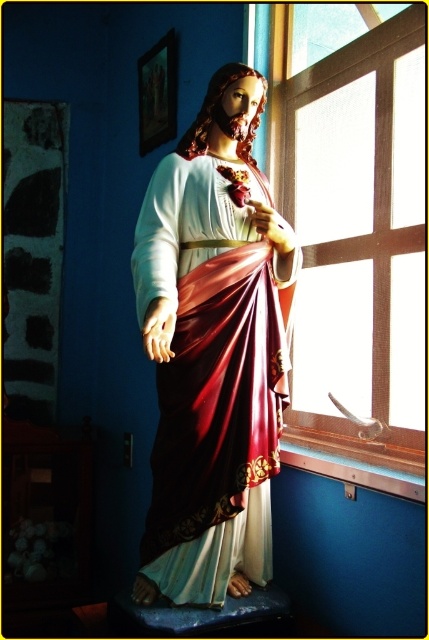
Question: Among these objects, which one is nearest to the camera?

Choices:
 (A) clear glass window at center
 (B) matte gold statue at center

Answer: (B)

Question: Does matte gold statue at center come in front of clear glass window at center?

Choices:
 (A) yes
 (B) no

Answer: (A)

Question: Can you confirm if matte gold statue at center is bigger than clear glass window at center?

Choices:
 (A) no
 (B) yes

Answer: (A)

Question: Which point is farther from the camera taking this photo?

Choices:
 (A) (260, 476)
 (B) (337, 435)

Answer: (B)

Question: Does matte gold statue at center appear on the right side of clear glass window at center?

Choices:
 (A) yes
 (B) no

Answer: (B)

Question: Which of the following is the closest to the observer?

Choices:
 (A) clear glass window at center
 (B) matte gold statue at center

Answer: (B)